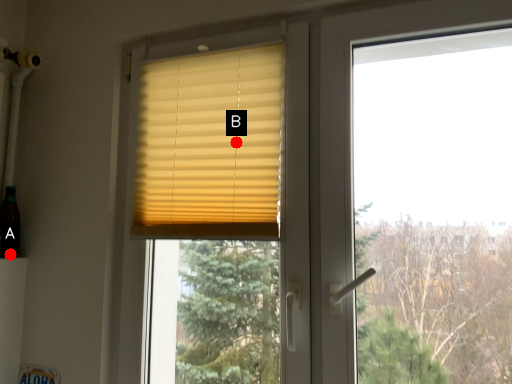
Question: Two points are circled on the image, labeled by A and B beside each circle. Which point appears farthest from the camera in this image?

Choices:
 (A) A is further
 (B) B is further

Answer: (A)